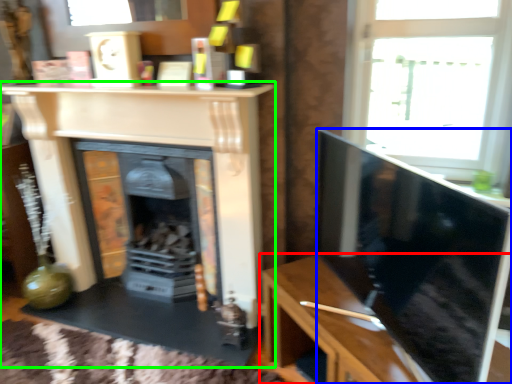
Question: Based on their relative distances, which object is nearer to table (highlighted by a red box)? Choose from screen (highlighted by a blue box) and fireplace (highlighted by a green box).

Choices:
 (A) screen
 (B) fireplace

Answer: (A)